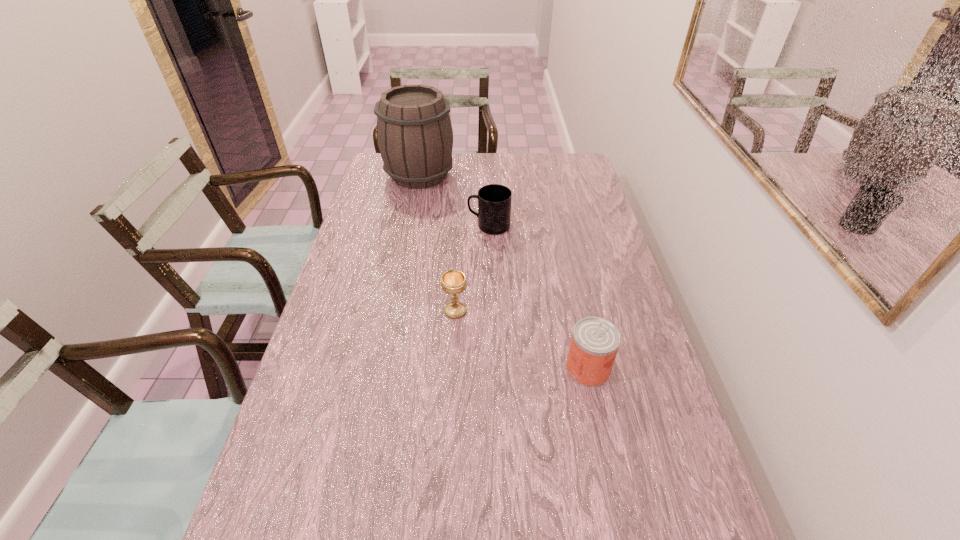
Where is `vacant space in between the rightmost object and the chalice`? vacant space in between the rightmost object and the chalice is located at coordinates (521, 340).

Where is `free space between the farthest object and the second nearest object`? free space between the farthest object and the second nearest object is located at coordinates (438, 243).

Identify the location of free area in between the wine bucket and the second farthest object. (454, 200).

This screenshot has width=960, height=540. Find the location of `vacant area that lies between the mug and the second nearest object`. vacant area that lies between the mug and the second nearest object is located at coordinates (472, 268).

This screenshot has height=540, width=960. I want to click on vacant area that lies between the can and the chalice, so click(x=521, y=340).

The height and width of the screenshot is (540, 960). What are the coordinates of `vacant space in between the third nearest object and the tallest object` in the screenshot? It's located at (454, 200).

Find the location of a particular element. This screenshot has width=960, height=540. object identified as the closest to the chalice is located at coordinates (595, 341).

Locate an element on the screen. object that stands as the third closest to the second nearest object is located at coordinates (414, 132).

At what (x,y) coordinates should I click in order to perform the action: click on vacant space that satisfies the following two spatial constraints: 1. on the side of the third nearest object with the handle; 2. on the right side of the rightmost object. Please return your answer as a coordinate pair (x, y). The height and width of the screenshot is (540, 960). Looking at the image, I should click on (492, 369).

This screenshot has height=540, width=960. Find the location of `free space that satisfies the following two spatial constraints: 1. on the side of the mug with the handle; 2. on the left side of the can`. free space that satisfies the following two spatial constraints: 1. on the side of the mug with the handle; 2. on the left side of the can is located at coordinates (492, 369).